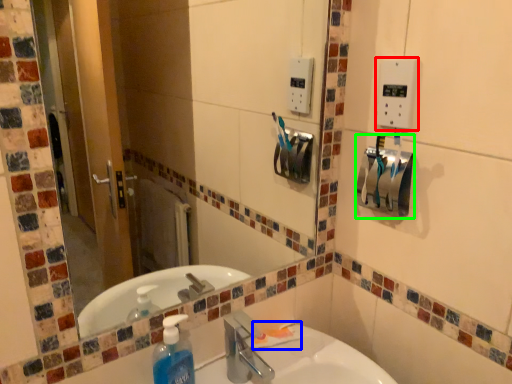
Question: Based on their relative distances, which object is farther from light switch (highlighted by a red box)? Choose from toothpaste (highlighted by a blue box) and hand dryer (highlighted by a green box).

Choices:
 (A) toothpaste
 (B) hand dryer

Answer: (A)